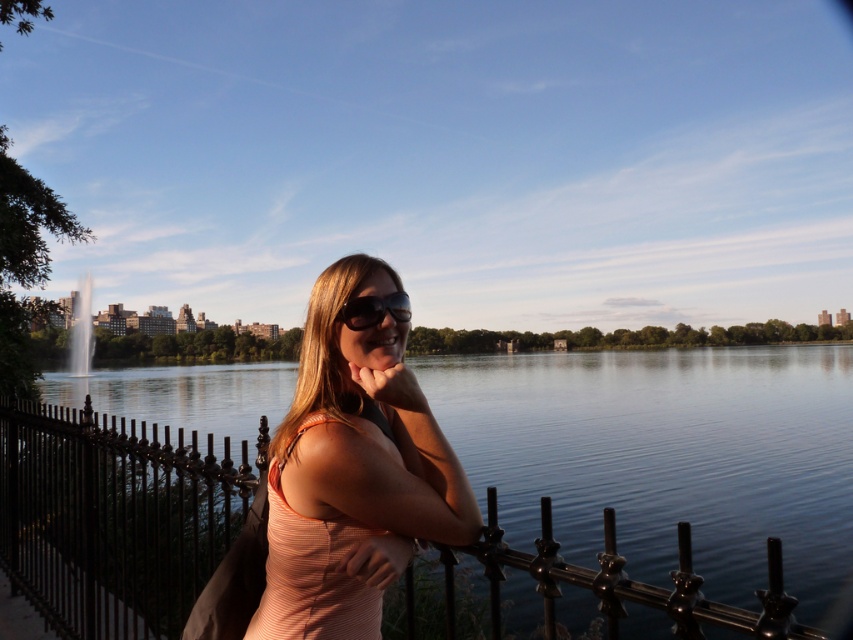
Question: From the image, what is the correct spatial relationship of matte orange tank top at center in relation to shiny silver fountain at center?

Choices:
 (A) above
 (B) below

Answer: (A)

Question: Which of the following is the farthest from the observer?

Choices:
 (A) shiny black sunglasses at center
 (B) shiny silver fountain at center
 (C) black wrought iron fence at center
 (D) matte orange tank top at center

Answer: (B)

Question: Which object is the farthest from the matte orange tank top at center?

Choices:
 (A) shiny silver fountain at center
 (B) black wrought iron fence at center
 (C) shiny black sunglasses at center

Answer: (A)

Question: Which point is closer to the camera?

Choices:
 (A) (450, 605)
 (B) (86, 324)
 (C) (384, 403)
 (D) (373, 307)

Answer: (D)

Question: Does matte orange tank top at center have a lesser width compared to shiny black sunglasses at center?

Choices:
 (A) yes
 (B) no

Answer: (B)

Question: Does shiny black sunglasses at center have a larger size compared to shiny silver fountain at center?

Choices:
 (A) yes
 (B) no

Answer: (B)